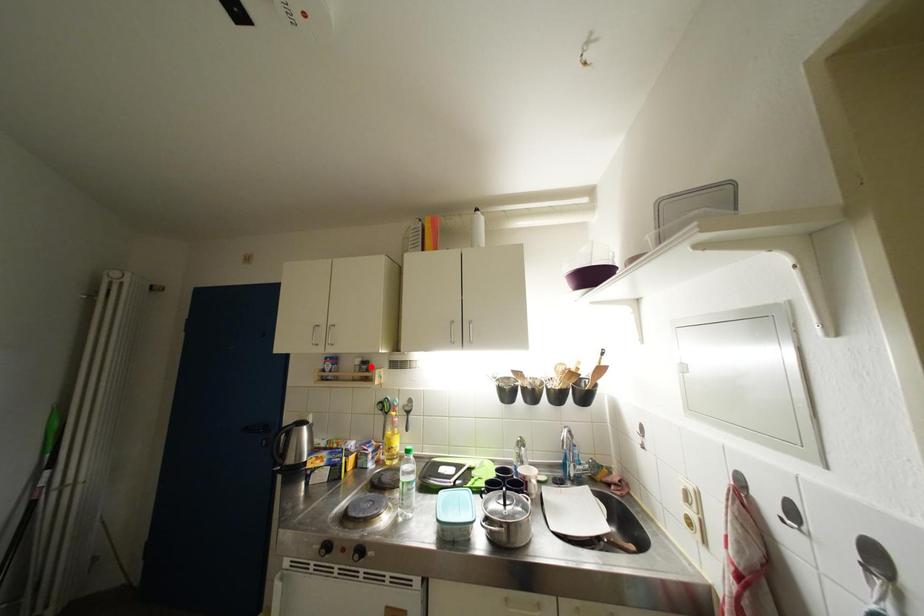
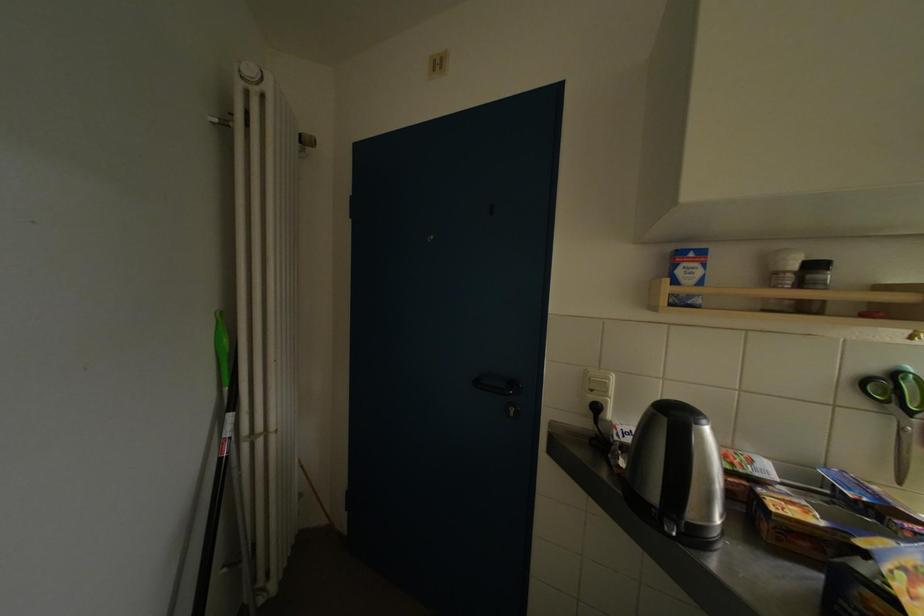
In the second image, find the point that corresponds to the highlighted location in the first image.

(821, 270)